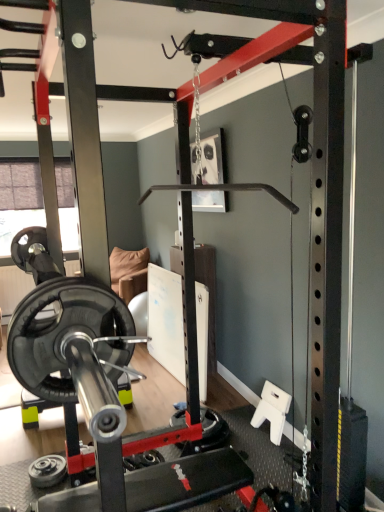
Question: From the image's perspective, would you say black rubber weight plate at lower left, the second wheel in the back-to-front sequence, is shown under black rubber barbell at center?

Choices:
 (A) no
 (B) yes

Answer: (B)

Question: Does black rubber weight plate at lower left, which is the 2th wheel in top-to-bottom order, have a greater height compared to black rubber barbell at center?

Choices:
 (A) yes
 (B) no

Answer: (B)

Question: Does black rubber weight plate at lower left, placed as the first wheel when sorted from front to back, come behind black rubber barbell at center?

Choices:
 (A) yes
 (B) no

Answer: (A)

Question: Can you confirm if black rubber weight plate at lower left, which is the first wheel from left to right, is positioned to the right of black rubber barbell at center?

Choices:
 (A) yes
 (B) no

Answer: (B)

Question: Is black rubber barbell at center located within black rubber weight plate at lower left, the second wheel in the back-to-front sequence?

Choices:
 (A) no
 (B) yes

Answer: (A)

Question: From the image's perspective, is black rubber weight plate at lower left, which is the first wheel from left to right, over black rubber barbell at center?

Choices:
 (A) no
 (B) yes

Answer: (A)

Question: Considering the relative positions of black rubber barbell at center and black rubber weight plate at lower left, the second wheel in the back-to-front sequence, in the image provided, is black rubber barbell at center behind black rubber weight plate at lower left, the second wheel in the back-to-front sequence,?

Choices:
 (A) no
 (B) yes

Answer: (A)

Question: Can you confirm if black rubber barbell at center is wider than black rubber weight plate at lower left, placed as the first wheel when sorted from front to back?

Choices:
 (A) yes
 (B) no

Answer: (A)

Question: Is black rubber barbell at center shorter than black rubber weight plate at lower left, placed as the first wheel when sorted from front to back?

Choices:
 (A) yes
 (B) no

Answer: (B)

Question: From the image's perspective, would you say black rubber barbell at center is shown under black rubber weight plate at lower left, marked as the first wheel in a bottom-to-top arrangement?

Choices:
 (A) no
 (B) yes

Answer: (A)

Question: Can black rubber weight plate at lower left, which is the 2th wheel in top-to-bottom order, be found inside black rubber barbell at center?

Choices:
 (A) yes
 (B) no

Answer: (A)

Question: Is black rubber barbell at center bigger than black rubber weight plate at lower left, placed as the first wheel when sorted from front to back?

Choices:
 (A) no
 (B) yes

Answer: (B)

Question: Is there a large distance between black rubber weight plate at lower left, which is the first wheel from left to right, and black rubber wheel at center, placed as the first wheel when sorted from top to bottom?

Choices:
 (A) yes
 (B) no

Answer: (B)